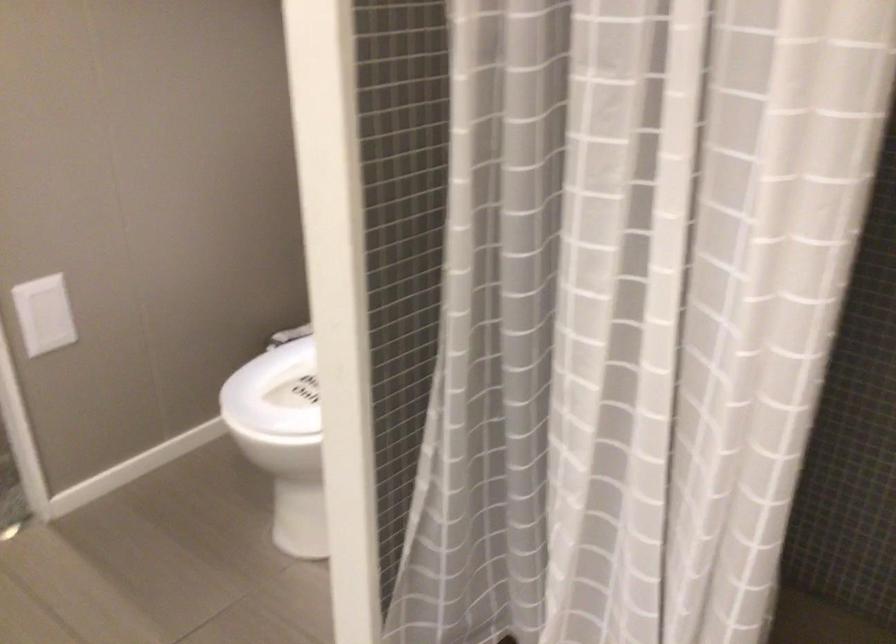
Where is `white toilet lid`? white toilet lid is located at coordinates (303, 381).